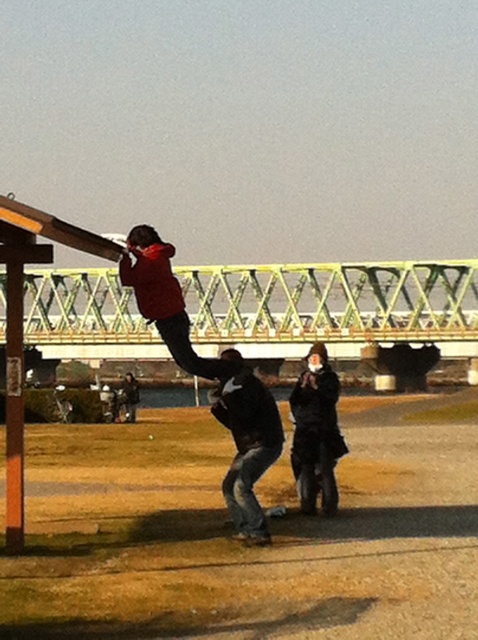
You are standing on the paved path in the park and see the dark gray jeans at center and the matte red jacket at center. Which one is positioned to the right side?

The dark gray jeans at center is to the right of matte red jacket at center.

You are a photographer standing at the edge of the paved path in the park. You want to take a photo of the black fur coat at center and the matte red jacket at center. Can you fit both subjects into your camera frame if your camera has a maximum horizontal field of view of 6 feet?

The black fur coat at center and matte red jacket at center are 5.90 feet apart, which is just under the camera frame limit of 6 feet. Therefore, both subjects can be captured in the same photo.